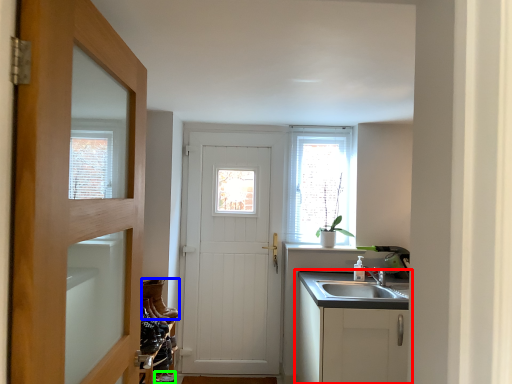
Question: Which object is the closest to the cabinetry (highlighted by a red box)? Choose among these: shoe (highlighted by a blue box) or shoe (highlighted by a green box).

Choices:
 (A) shoe
 (B) shoe

Answer: (A)